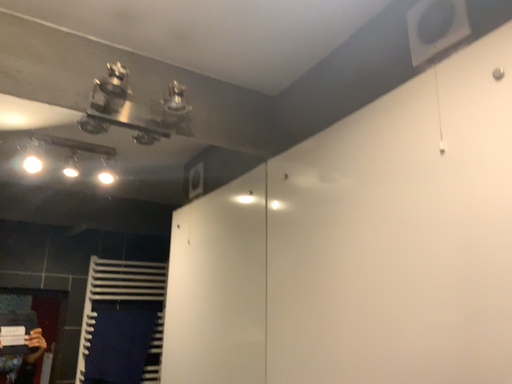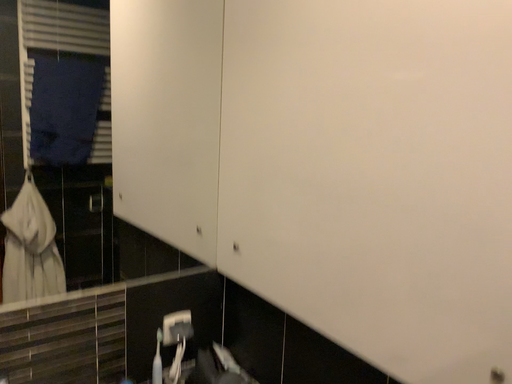
Question: Which way did the camera rotate in the video?

Choices:
 (A) rotated downward
 (B) rotated upward

Answer: (A)